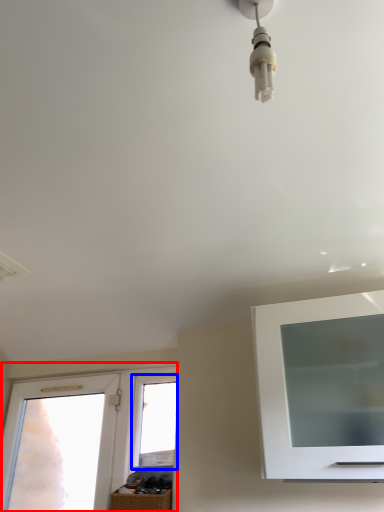
Question: Which of the following is the closest to the observer, window (highlighted by a red box) or window (highlighted by a blue box)?

Choices:
 (A) window
 (B) window

Answer: (A)